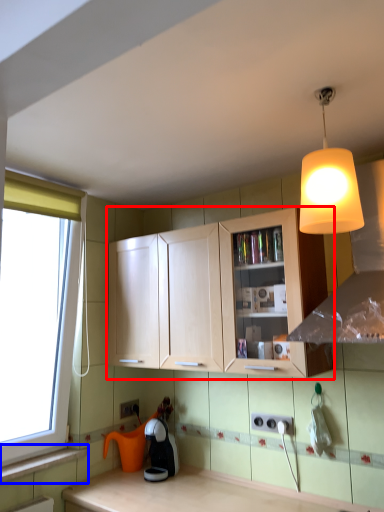
Question: Which object appears farthest to the camera in this image, cabinetry (highlighted by a red box) or window sill (highlighted by a blue box)?

Choices:
 (A) cabinetry
 (B) window sill

Answer: (B)